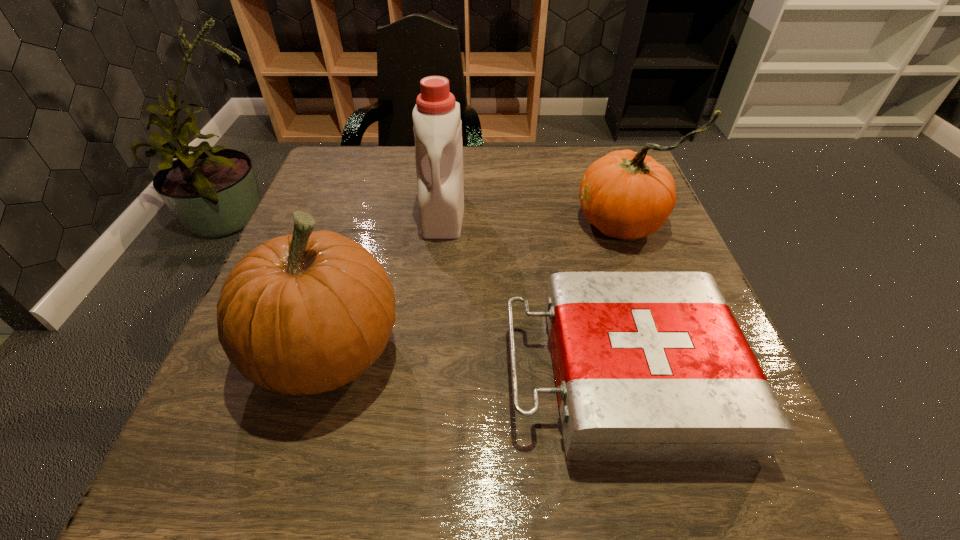
This screenshot has width=960, height=540. In order to click on detergent that is at the far edge in this screenshot , I will do `click(437, 127)`.

The height and width of the screenshot is (540, 960). What are the coordinates of `pumpkin positioned at the far edge` in the screenshot? It's located at (627, 195).

Locate an element on the screen. object located at the near edge is located at coordinates pos(649,366).

The image size is (960, 540). Find the location of `object situated at the left edge`. object situated at the left edge is located at coordinates [x=306, y=313].

This screenshot has width=960, height=540. In order to click on pumpkin located at the right edge in this screenshot , I will do `click(627, 195)`.

What are the coordinates of `the first-aid kit that is positioned at the right edge` in the screenshot? It's located at (649, 366).

Where is `object positioned at the far right corner`? The width and height of the screenshot is (960, 540). object positioned at the far right corner is located at coordinates (x=627, y=195).

This screenshot has width=960, height=540. Find the location of `object that is at the near right corner`. object that is at the near right corner is located at coordinates (649, 366).

Identify the location of vacant space at the far edge of the desktop. This screenshot has height=540, width=960. (557, 171).

The width and height of the screenshot is (960, 540). What are the coordinates of `free space at the near edge` in the screenshot? It's located at (507, 461).